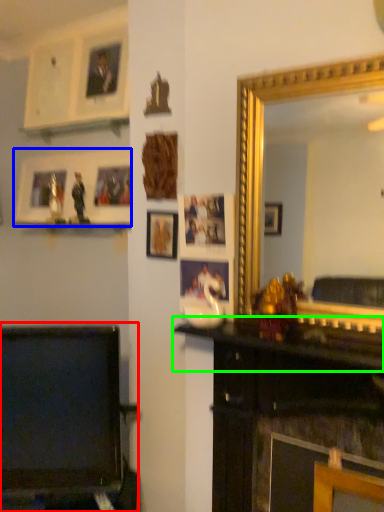
Question: Which object is the farthest from furniture (highlighted by a red box)? Choose among these: picture frame (highlighted by a blue box) or mantle (highlighted by a green box).

Choices:
 (A) picture frame
 (B) mantle

Answer: (A)